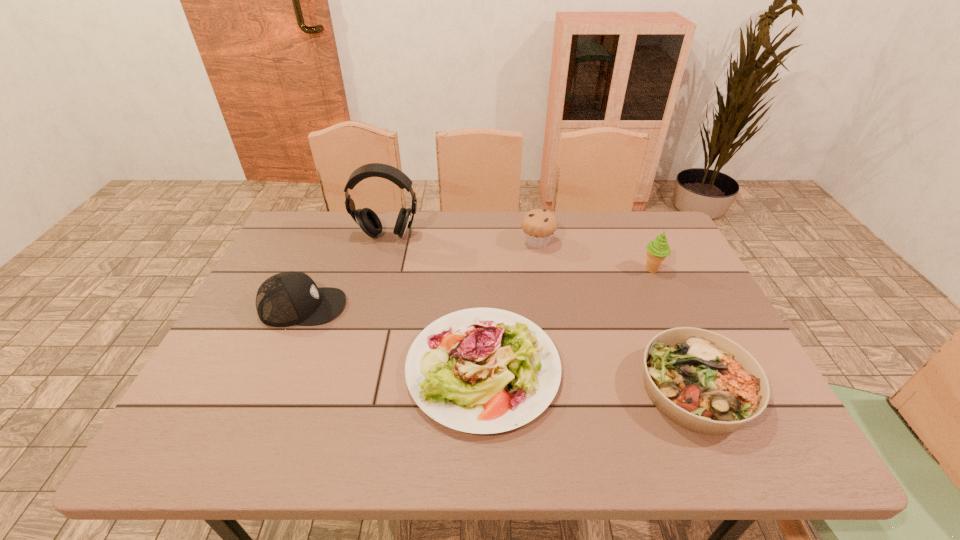
Locate an element on the screen. This screenshot has height=540, width=960. earphone is located at coordinates (367, 219).

At what (x,y) coordinates should I click in order to perform the action: click on icecream. Please return your answer as a coordinate pair (x, y). This screenshot has width=960, height=540. Looking at the image, I should click on tap(657, 250).

Locate an element on the screen. This screenshot has height=540, width=960. the third farthest object is located at coordinates (657, 250).

I want to click on muffin, so click(538, 225).

At what (x,y) coordinates should I click in order to perform the action: click on cap. Please return your answer as a coordinate pair (x, y). Looking at the image, I should click on (285, 299).

Where is `the left salad plate`? The height and width of the screenshot is (540, 960). the left salad plate is located at coordinates (481, 370).

This screenshot has width=960, height=540. What are the coordinates of `the right salad plate` in the screenshot? It's located at (704, 382).

At what (x,y) coordinates should I click in order to perform the action: click on vacant point located on the ear cups of the tallest object. Please return your answer as a coordinate pair (x, y). Looking at the image, I should click on (372, 294).

At what (x,y) coordinates should I click in order to perform the action: click on free spot located 0.230m on the back of the icecream. Please return your answer as a coordinate pair (x, y). This screenshot has height=540, width=960. Looking at the image, I should click on (629, 218).

Find the location of a particular element. free space located on the front of the muffin is located at coordinates (541, 268).